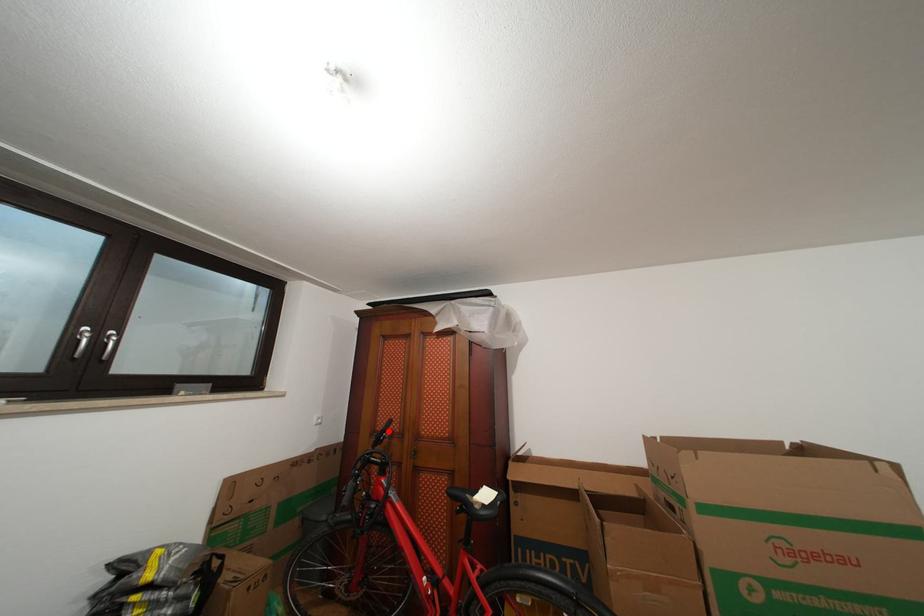
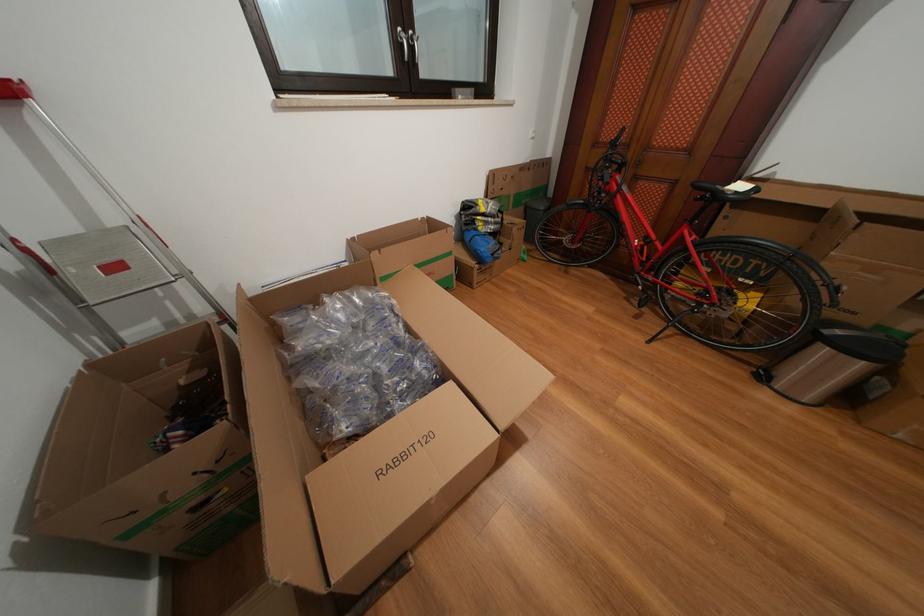
In the second image, find the point that corresponds to the highlighted location in the first image.

(617, 140)